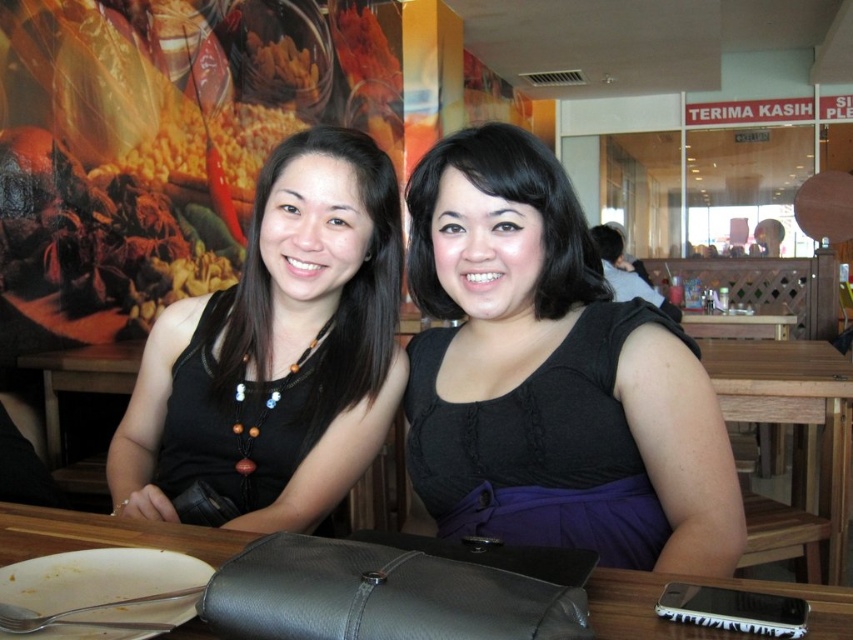
Which is behind, point (209, 396) or point (715, 376)?

The point (715, 376) is behind.

Which is in front, point (260, 268) or point (778, 342)?

Point (260, 268) is more forward.

Describe the element at coordinates (277, 349) in the screenshot. I see `black matte tank top at center` at that location.

This screenshot has height=640, width=853. What are the coordinates of `black matte tank top at center` in the screenshot? It's located at (277, 349).

Can you confirm if black matte dress at center is positioned to the left of black matte tank top at center?

No, black matte dress at center is not to the left of black matte tank top at center.

Which of these two, black matte dress at center or black matte tank top at center, stands taller?

Standing taller between the two is black matte tank top at center.

This screenshot has width=853, height=640. What do you see at coordinates (553, 369) in the screenshot?
I see `black matte dress at center` at bounding box center [553, 369].

Where is `black matte dress at center`? This screenshot has width=853, height=640. black matte dress at center is located at coordinates (553, 369).

Between wooden table at lower right and yellow popcorn at upper left, which one is positioned lower?

wooden table at lower right is below.

Is wooden table at lower right to the right of yellow popcorn at upper left from the viewer's perspective?

Indeed, wooden table at lower right is positioned on the right side of yellow popcorn at upper left.

Who is more forward, [805,380] or [152,132]?

Point [805,380] is in front.

What are the coordinates of `wooden table at lower right` in the screenshot? It's located at (793, 440).